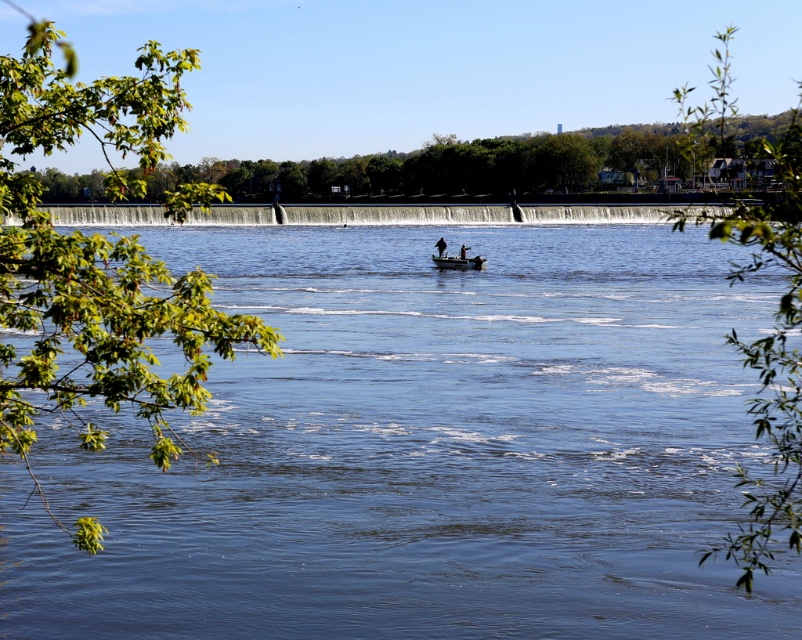
Can you confirm if blue water at center is positioned to the right of matte black boat at center?

In fact, blue water at center is to the left of matte black boat at center.

Which is below, blue water at center or matte black boat at center?

Positioned lower is blue water at center.

Locate an element on the screen. The height and width of the screenshot is (640, 802). blue water at center is located at coordinates (423, 449).

Can you confirm if black matte boat at center is positioned to the right of matte black boat at center?

Incorrect, black matte boat at center is not on the right side of matte black boat at center.

Image resolution: width=802 pixels, height=640 pixels. I want to click on black matte boat at center, so click(440, 246).

The height and width of the screenshot is (640, 802). Identify the location of black matte boat at center. (440, 246).

Between blue water at center and matte black canoe at center, which one is positioned higher?

matte black canoe at center is higher up.

Does blue water at center have a greater width compared to matte black canoe at center?

Correct, the width of blue water at center exceeds that of matte black canoe at center.

From the picture: Who is more distant from viewer, (x=472, y=292) or (x=483, y=266)?

Point (x=483, y=266)

Where is `blue water at center`? This screenshot has height=640, width=802. blue water at center is located at coordinates (423, 449).